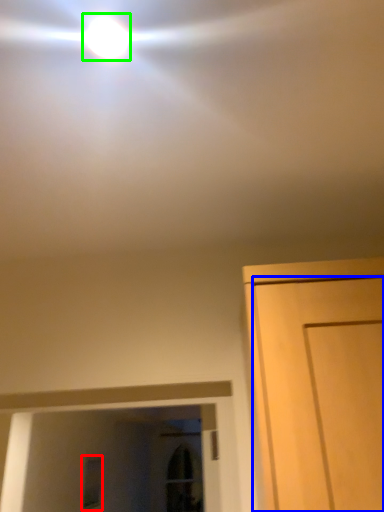
Question: Based on their relative distances, which object is farther from window (highlighted by a red box)? Choose from door (highlighted by a blue box) and droplight (highlighted by a green box).

Choices:
 (A) door
 (B) droplight

Answer: (B)